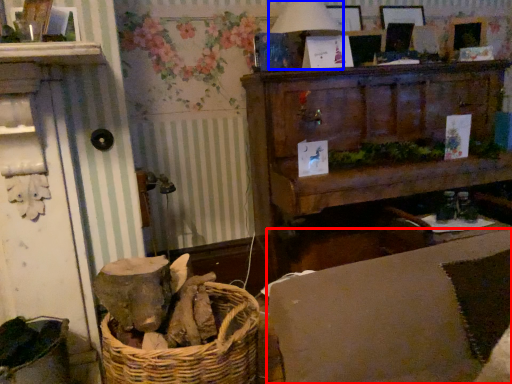
Question: Which object appears closest to the camera in this image, couch (highlighted by a red box) or table lamp (highlighted by a blue box)?

Choices:
 (A) couch
 (B) table lamp

Answer: (A)